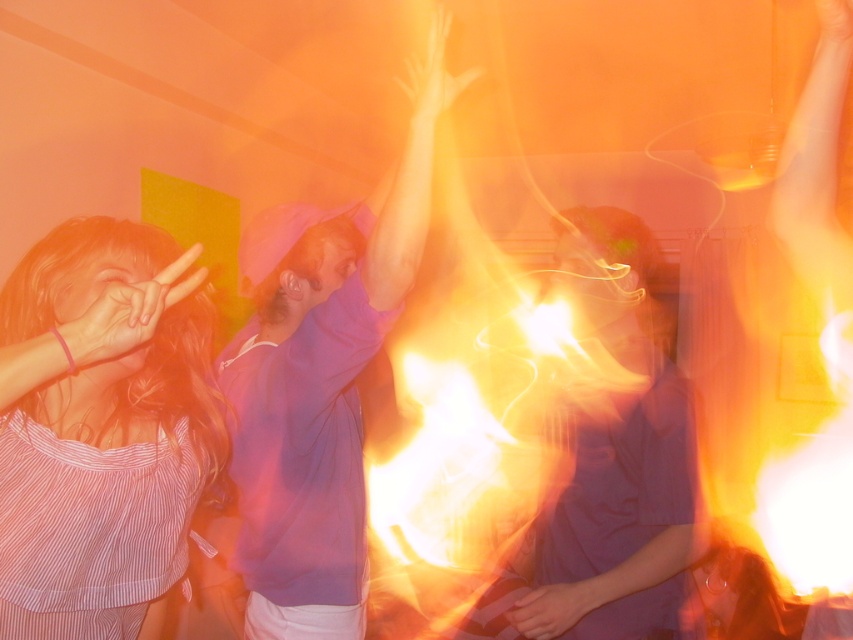
You are at the party scene described. There is a striped fabric shirt at left and a purple shirt and hat in the center. Which object is closer to the point at coordinate (103,404)?

The striped fabric shirt at left is represented by point (103,404), so it is exactly at that coordinate.

You are standing in the middle of the room and see two points marked in the image. Which point is closer to you, point (375, 211) or point (653, 241)?

Point (375, 211) is closer to you because it is further to the viewer than point (653, 241).

You are at a party and see two purple items at the center of the scene. Which one is taller between the purple matte hoodie at center and the purple matte shirt at center?

The purple matte hoodie at center is taller than the purple matte shirt at center.